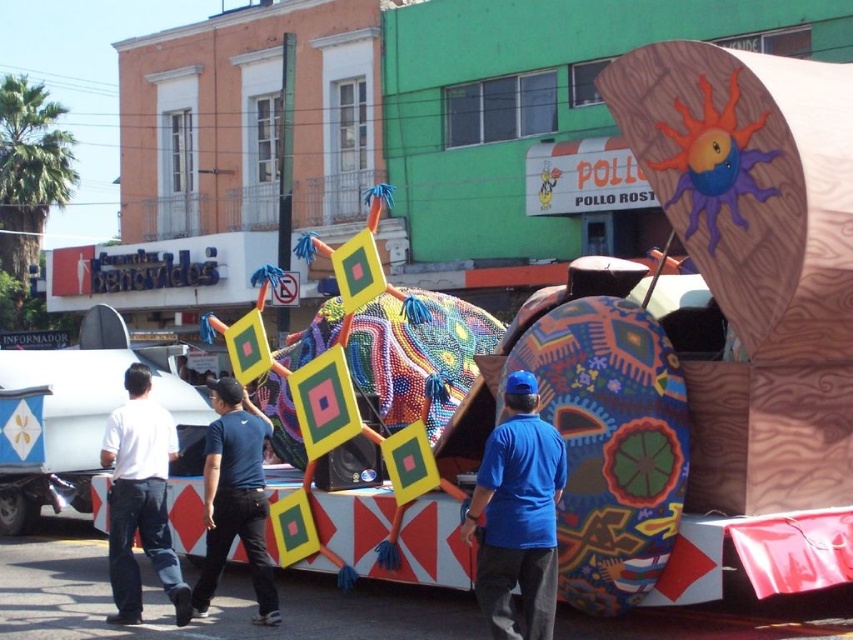
Does blue fabric shirt at center appear over white shirt at left?

Yes.

Can you confirm if blue fabric shirt at center is smaller than white shirt at left?

Indeed, blue fabric shirt at center has a smaller size compared to white shirt at left.

At what (x,y) coordinates should I click in order to perform the action: click on blue fabric shirt at center. Please return your answer as a coordinate pair (x, y). This screenshot has width=853, height=640. Looking at the image, I should click on (517, 515).

At what (x,y) coordinates should I click in order to perform the action: click on blue fabric shirt at center. Please return your answer as a coordinate pair (x, y). The image size is (853, 640). Looking at the image, I should click on (517, 515).

In the scene shown: Does blue fabric shirt at center lie behind blue cotton shirt at center?

No.

Who is lower down, blue fabric shirt at center or blue cotton shirt at center?

blue cotton shirt at center is lower down.

What do you see at coordinates (517, 515) in the screenshot? This screenshot has width=853, height=640. I see `blue fabric shirt at center` at bounding box center [517, 515].

The height and width of the screenshot is (640, 853). Identify the location of blue fabric shirt at center. (517, 515).

Can you confirm if white shirt at left is taller than blue cotton shirt at center?

Correct, white shirt at left is much taller as blue cotton shirt at center.

What do you see at coordinates (140, 499) in the screenshot? Image resolution: width=853 pixels, height=640 pixels. I see `white shirt at left` at bounding box center [140, 499].

This screenshot has width=853, height=640. What are the coordinates of `white shirt at left` in the screenshot? It's located at (140, 499).